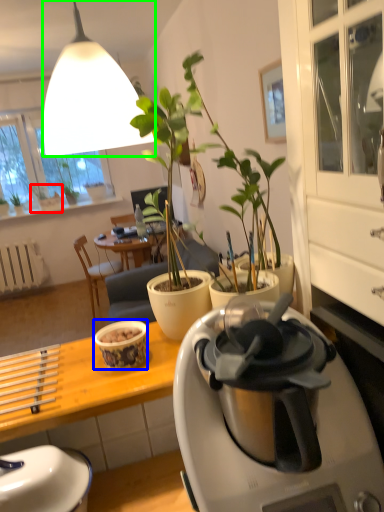
Question: Estimate the real-world distances between objects in this image. Which object is farther from houseplant (highlighted by a red box), coffee cup (highlighted by a blue box) or lamp (highlighted by a green box)?

Choices:
 (A) coffee cup
 (B) lamp

Answer: (B)